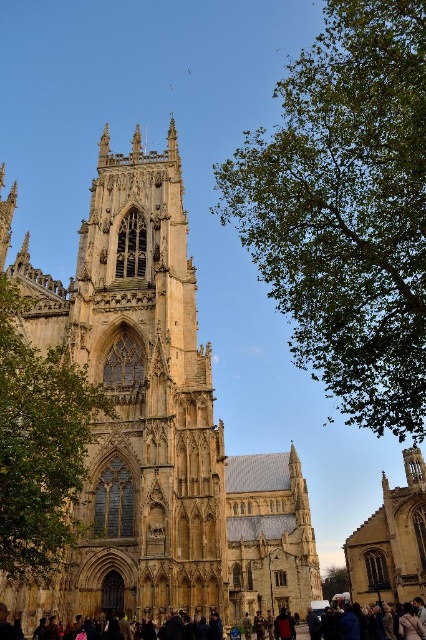
Looking at the image of York Minster, you notice the golden stone church at center and the green leafy tree at upper right. Which of these two objects is positioned to the left when viewed from the cathedral?

The golden stone church at center is positioned to the left of the green leafy tree at upper right.

You are standing at the base of York Minster and notice two points marked on the cathedral facade. The first point is located at coordinates point (100,410) and the second at point (347,588). From your vantage point, which point appears closer to you?

Point (100,410) is in front of point (347,588), so the first point appears closer to you.